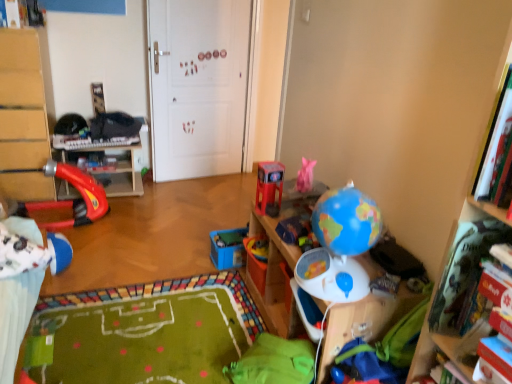
Question: Can you see blue matte globe at right, acting as the 2th toy starting from the right, touching rubberized red slide at left?

Choices:
 (A) no
 (B) yes

Answer: (A)

Question: Is blue matte globe at right, marked as the 6th toy in a left-to-right arrangement, looking in the opposite direction of rubberized red slide at left?

Choices:
 (A) yes
 (B) no

Answer: (B)

Question: Is blue matte globe at right, acting as the 2th toy starting from the right, shorter than rubberized red slide at left?

Choices:
 (A) yes
 (B) no

Answer: (B)

Question: From a real-world perspective, is blue matte globe at right, marked as the 6th toy in a left-to-right arrangement, positioned over rubberized red slide at left based on gravity?

Choices:
 (A) yes
 (B) no

Answer: (A)

Question: Is blue matte globe at right, marked as the 6th toy in a left-to-right arrangement, further to camera compared to rubberized red slide at left?

Choices:
 (A) no
 (B) yes

Answer: (A)

Question: In terms of height, does blue plastic toy at center, arranged as the sixth toy when viewed from the right, look taller or shorter compared to matte plastic book at left, the 1th book in the back-to-front sequence?

Choices:
 (A) tall
 (B) short

Answer: (A)

Question: Which is correct: blue plastic toy at center, marked as the second toy in a left-to-right arrangement, is inside matte plastic book at left, the 2th book from the bottom, or outside of it?

Choices:
 (A) inside
 (B) outside

Answer: (B)

Question: Visually, is blue plastic toy at center, arranged as the sixth toy when viewed from the right, positioned to the left or to the right of matte plastic book at left, positioned as the first book in left-to-right order?

Choices:
 (A) right
 (B) left

Answer: (A)

Question: From a real-world perspective, is blue plastic toy at center, marked as the second toy in a left-to-right arrangement, above or below matte plastic book at left, positioned as the first book in left-to-right order?

Choices:
 (A) above
 (B) below

Answer: (B)

Question: Is hardcover book at right, arranged as the 1th book when viewed from the right, inside the boundaries of shiny red toy car at center, acting as the fourth toy starting from the right, or outside?

Choices:
 (A) inside
 (B) outside

Answer: (B)

Question: In terms of width, does hardcover book at right, positioned as the second book in top-to-bottom order, look wider or thinner when compared to shiny red toy car at center, acting as the fourth toy starting from the right?

Choices:
 (A) thin
 (B) wide

Answer: (B)

Question: Is point (457, 256) positioned closer to the camera than point (273, 165)?

Choices:
 (A) closer
 (B) farther

Answer: (A)

Question: Considering the positions of hardcover book at right, positioned as the second book in top-to-bottom order, and shiny red toy car at center, the fourth toy from the left, in the image, is hardcover book at right, positioned as the second book in top-to-bottom order, bigger or smaller than shiny red toy car at center, the fourth toy from the left,?

Choices:
 (A) big
 (B) small

Answer: (A)

Question: Based on their positions, is shiny red toy car at center, acting as the fourth toy starting from the right, located to the left or right of rubberized red slide at left?

Choices:
 (A) right
 (B) left

Answer: (A)

Question: Relative to rubberized red slide at left, is shiny red toy car at center, the fourth toy from the left, in front or behind?

Choices:
 (A) behind
 (B) front

Answer: (B)